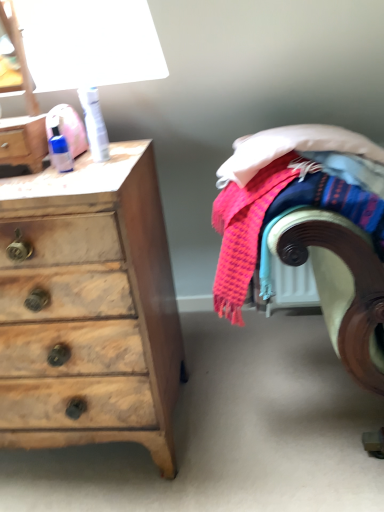
Where is `free spot to the left of blue plastic bottle at upper left, which is counted as the 2th toiletry, starting from the right`? Image resolution: width=384 pixels, height=512 pixels. free spot to the left of blue plastic bottle at upper left, which is counted as the 2th toiletry, starting from the right is located at coordinates (x=31, y=174).